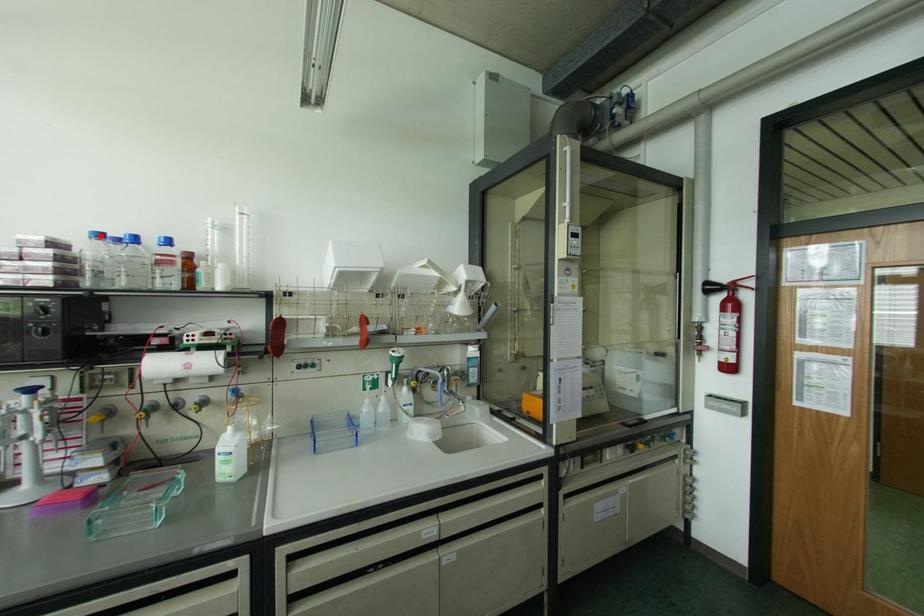
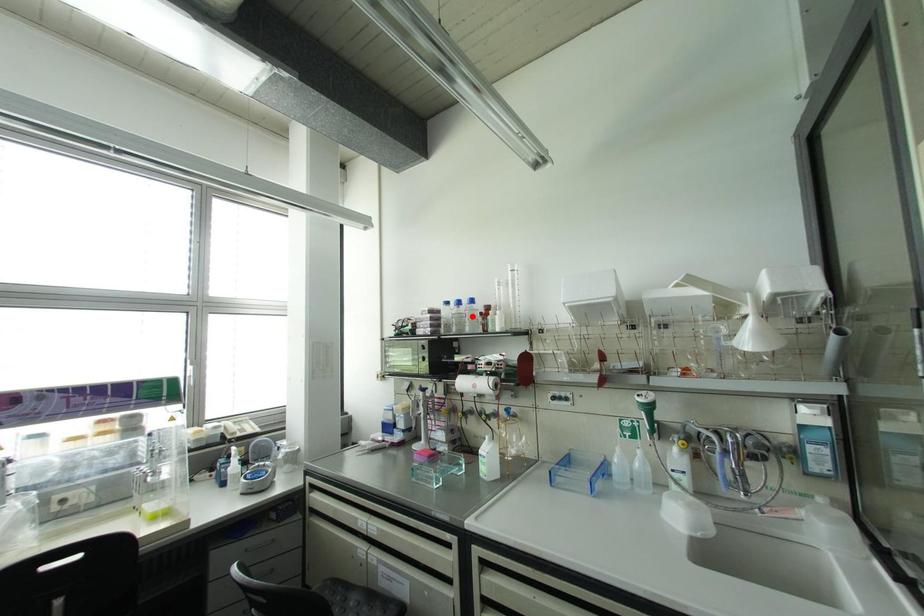
I am providing you with two images of the same scene from different viewpoints. A red point is marked on the first image and another point is marked on the second image. Is the red point in image1 aligned with the point shown in image2?

No